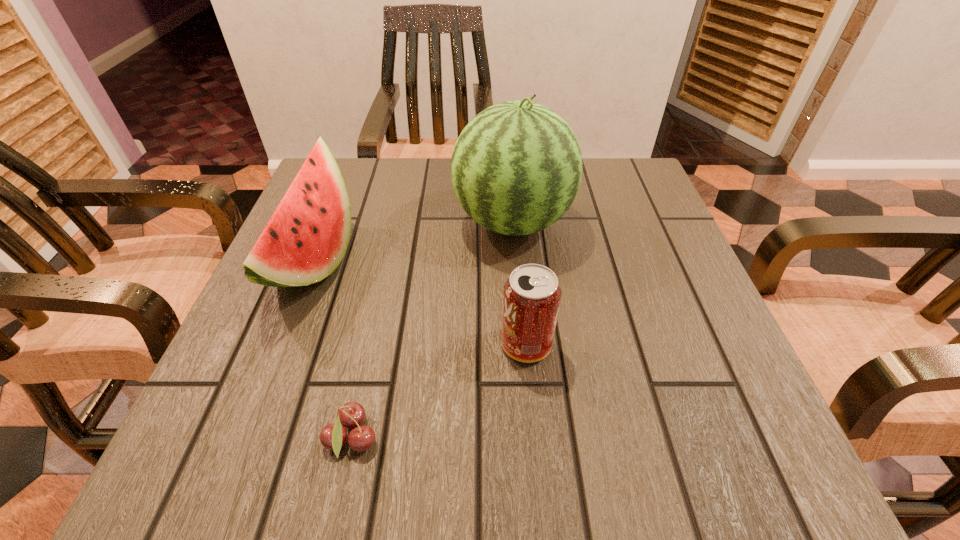
You are a GUI agent. You are given a task and a screenshot of the screen. Output one action in this format:
    pyautogui.click(x=<x>, y=<y>)
    Task: Click on the taller watermelon
    
    Given the screenshot: What is the action you would take?
    pyautogui.click(x=516, y=168)

Locate an element on the screen. The height and width of the screenshot is (540, 960). the right watermelon is located at coordinates (516, 168).

I want to click on the third shortest object, so click(x=306, y=238).

This screenshot has height=540, width=960. What are the coordinates of `the left watermelon` in the screenshot? It's located at [x=306, y=238].

This screenshot has width=960, height=540. Find the location of `soda can`. soda can is located at coordinates (531, 297).

Identify the location of the nearest object. (333, 436).

Find the location of a particular element. the shortest object is located at coordinates (333, 436).

This screenshot has width=960, height=540. What are the coordinates of `vacant space situated on the left of the tallest object` in the screenshot? It's located at (396, 222).

Locate an element on the screen. The image size is (960, 540). free spot located on the outer rind of the left watermelon is located at coordinates (379, 261).

This screenshot has width=960, height=540. I want to click on vacant space situated 0.280m on the back of the soda can, so click(x=515, y=221).